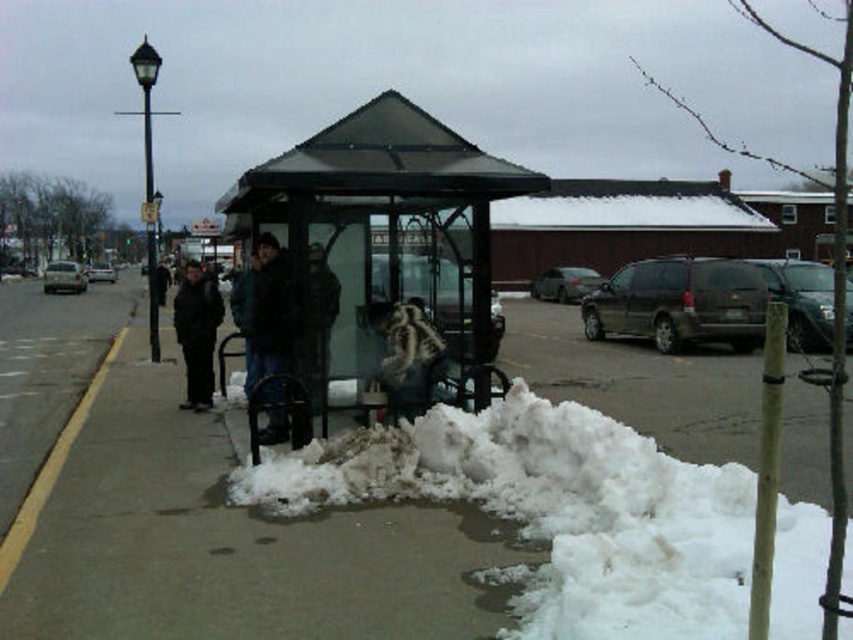
Question: Is white fluffy snow at lower center above transparent glass bus stop at center?

Choices:
 (A) yes
 (B) no

Answer: (B)

Question: Which point is closer to the camera?

Choices:
 (A) transparent glass bus stop at center
 (B) fuzzy fabric bag at center

Answer: (A)

Question: Considering the real-world distances, which object is farthest from the white fluffy snow at lower center?

Choices:
 (A) fuzzy fabric bag at center
 (B) dark matte jacket at left

Answer: (B)

Question: Is white fluffy snow at lower center to the right of dark matte jacket at left from the viewer's perspective?

Choices:
 (A) no
 (B) yes

Answer: (B)

Question: Does white fluffy snow at lower center appear on the right side of dark matte jacket at left?

Choices:
 (A) no
 (B) yes

Answer: (B)

Question: Estimate the real-world distances between objects in this image. Which object is farther from the white fluffy snow at lower center?

Choices:
 (A) dark matte jacket at left
 (B) fuzzy fabric bag at center
 (C) transparent glass bus stop at center

Answer: (A)